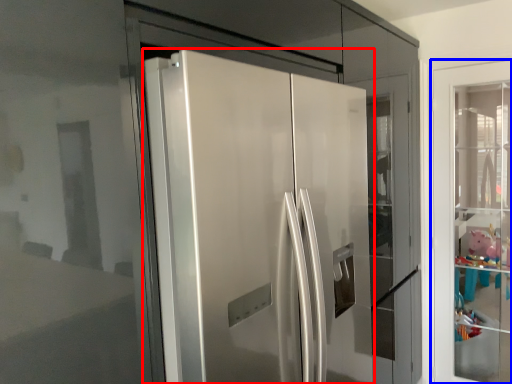
Question: Which object is further to the camera taking this photo, door (highlighted by a red box) or door (highlighted by a blue box)?

Choices:
 (A) door
 (B) door

Answer: (B)